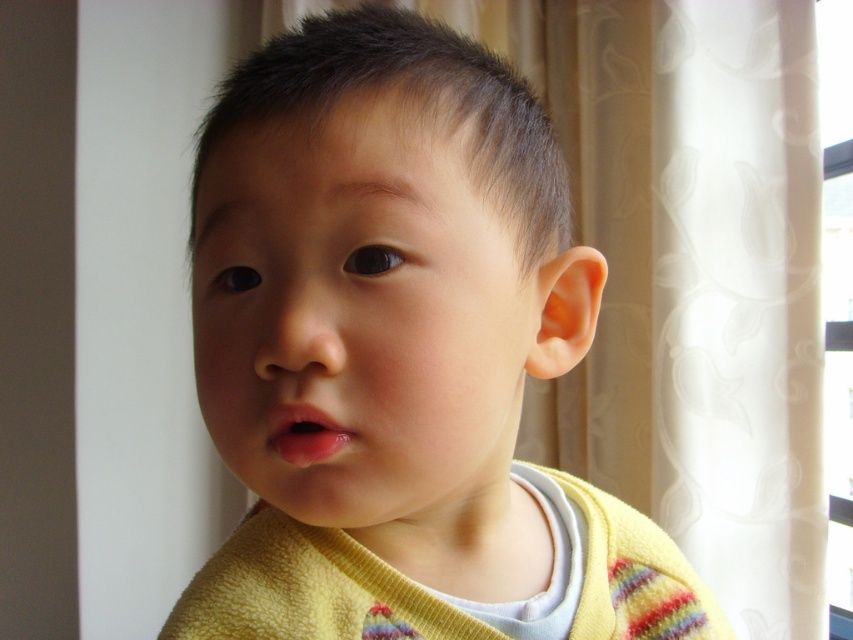
Is yellow soft sweater at center shorter than smooth skin face at center?

No.

Does yellow soft sweater at center have a larger size compared to smooth skin face at center?

Indeed, yellow soft sweater at center has a larger size compared to smooth skin face at center.

Does point (436, 636) come behind point (509, 228)?

Yes, it is behind point (509, 228).

The width and height of the screenshot is (853, 640). Find the location of `yellow soft sweater at center`. yellow soft sweater at center is located at coordinates (399, 355).

Does yellow soft sweater at center have a lesser height compared to transparent plastic window at upper right?

Indeed, yellow soft sweater at center has a lesser height compared to transparent plastic window at upper right.

Does yellow soft sweater at center appear on the left side of transparent plastic window at upper right?

Yes, yellow soft sweater at center is to the left of transparent plastic window at upper right.

Is point (503, 541) closer to viewer compared to point (833, 586)?

That is True.

The width and height of the screenshot is (853, 640). In order to click on yellow soft sweater at center in this screenshot , I will do `click(399, 355)`.

Is smooth skin face at center positioned before transparent plastic window at upper right?

That is True.

The width and height of the screenshot is (853, 640). What are the coordinates of `smooth skin face at center` in the screenshot? It's located at (360, 317).